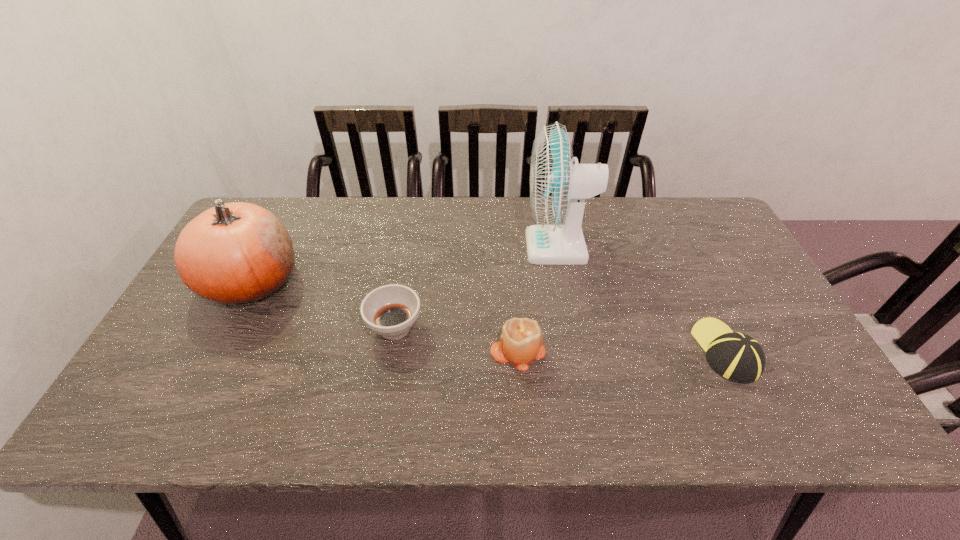
The image size is (960, 540). What are the coordinates of `free space located 0.310m on the right of the candle` in the screenshot? It's located at (671, 350).

This screenshot has height=540, width=960. I want to click on free spot located on the right of the second object from left to right, so click(x=500, y=327).

Where is `vacant space positioned with the brim of the baseball cap facing forward`? vacant space positioned with the brim of the baseball cap facing forward is located at coordinates (691, 278).

This screenshot has height=540, width=960. Identify the location of vacant point located 0.080m with the brim of the baseball cap facing forward. (701, 299).

Locate an element on the screen. free spot located with the brim of the baseball cap facing forward is located at coordinates (675, 244).

At what (x,y) coordinates should I click in order to perform the action: click on object located in the far edge section of the desktop. Please return your answer as a coordinate pair (x, y). Looking at the image, I should click on (558, 188).

Locate an element on the screen. object present at the left edge is located at coordinates (233, 253).

Where is `object that is at the right edge`? The image size is (960, 540). object that is at the right edge is located at coordinates (737, 357).

Where is `free space at the far edge of the desktop`? free space at the far edge of the desktop is located at coordinates (333, 201).

At what (x,y) coordinates should I click in order to perform the action: click on vacant space at the near edge of the desktop. Please return your answer as a coordinate pair (x, y). The image size is (960, 540). Looking at the image, I should click on (623, 408).